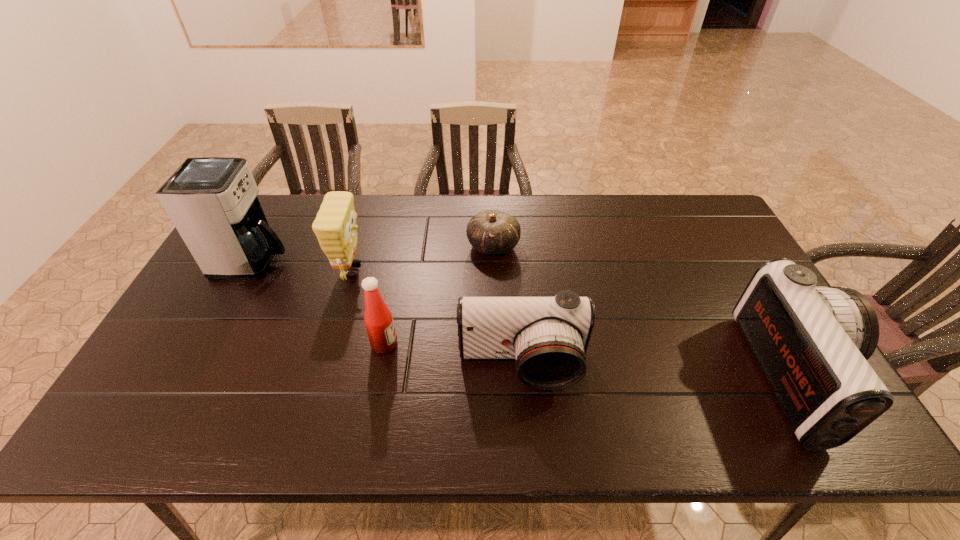
Find the location of a particular element. The image size is (960, 540). blank space at the far right corner of the desktop is located at coordinates [687, 233].

Where is `vacant space in between the gourd and the sponge`? The height and width of the screenshot is (540, 960). vacant space in between the gourd and the sponge is located at coordinates (422, 258).

You are a GUI agent. You are given a task and a screenshot of the screen. Output one action in this format:
    pyautogui.click(x=<x>, y=<y>)
    Task: Click on the vacant area that lies between the leftmost object and the shortest object
    Image resolution: width=960 pixels, height=540 pixels.
    Given the screenshot: What is the action you would take?
    pyautogui.click(x=373, y=253)

Locate an element on the screen. blank region between the rightmost object and the shorter camcorder is located at coordinates (659, 372).

Locate an element on the screen. object that ranks as the fifth closest to the left camcorder is located at coordinates (212, 201).

This screenshot has height=540, width=960. I want to click on object that is the fourth closest to the gourd, so pyautogui.click(x=212, y=201).

Locate an element on the screen. The image size is (960, 540). free space in the image that satisfies the following two spatial constraints: 1. on the front side of the shortest object; 2. on the front panel of the leftmost object is located at coordinates (493, 261).